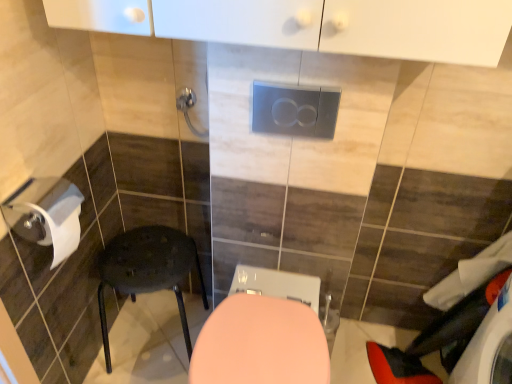
Question: Does satin silver flush plate at center have a greater height compared to white fabric laundry at lower right?

Choices:
 (A) yes
 (B) no

Answer: (B)

Question: From the image's perspective, is satin silver flush plate at center on top of white fabric laundry at lower right?

Choices:
 (A) yes
 (B) no

Answer: (A)

Question: Is the depth of satin silver flush plate at center less than that of white fabric laundry at lower right?

Choices:
 (A) yes
 (B) no

Answer: (A)

Question: Can you confirm if satin silver flush plate at center is thinner than white fabric laundry at lower right?

Choices:
 (A) yes
 (B) no

Answer: (A)

Question: Is satin silver flush plate at center facing away from white fabric laundry at lower right?

Choices:
 (A) no
 (B) yes

Answer: (A)

Question: Can we say satin silver flush plate at center lies outside white fabric laundry at lower right?

Choices:
 (A) yes
 (B) no

Answer: (A)

Question: Does pink glossy toilet at center appear on the right side of metallic silver towel bar at upper center?

Choices:
 (A) yes
 (B) no

Answer: (A)

Question: Considering the relative sizes of pink glossy toilet at center and metallic silver towel bar at upper center in the image provided, is pink glossy toilet at center shorter than metallic silver towel bar at upper center?

Choices:
 (A) no
 (B) yes

Answer: (A)

Question: Does pink glossy toilet at center have a greater width compared to metallic silver towel bar at upper center?

Choices:
 (A) yes
 (B) no

Answer: (A)

Question: Is pink glossy toilet at center taller than metallic silver towel bar at upper center?

Choices:
 (A) yes
 (B) no

Answer: (A)

Question: From the image's perspective, is pink glossy toilet at center beneath metallic silver towel bar at upper center?

Choices:
 (A) yes
 (B) no

Answer: (A)

Question: Does pink glossy toilet at center have a smaller size compared to metallic silver towel bar at upper center?

Choices:
 (A) no
 (B) yes

Answer: (A)

Question: Can you confirm if metallic silver towel bar at upper center is wider than matte black stool at lower left?

Choices:
 (A) no
 (B) yes

Answer: (A)